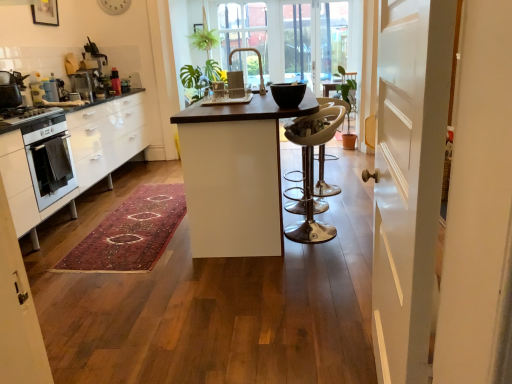
Question: Can you confirm if metallic silver coffee machine at left, the 3th appliance in the bottom-to-top sequence, is bigger than metallic silver coffee machine at left, which ranks as the second appliance in front-to-back order?

Choices:
 (A) yes
 (B) no

Answer: (A)

Question: Does metallic silver coffee machine at left, the second appliance from the right, appear on the right side of metallic silver coffee machine at left, which ranks as the second appliance in bottom-to-top order?

Choices:
 (A) no
 (B) yes

Answer: (B)

Question: From a real-world perspective, is metallic silver coffee machine at left, which is counted as the third appliance, starting from the left, below metallic silver coffee machine at left, the fourth appliance when ordered from right to left?

Choices:
 (A) no
 (B) yes

Answer: (A)

Question: Is the depth of metallic silver coffee machine at left, the 2th appliance positioned from the top, greater than that of metallic silver coffee machine at left, the fourth appliance when ordered from right to left?

Choices:
 (A) no
 (B) yes

Answer: (B)

Question: Can you confirm if metallic silver coffee machine at left, the 3th appliance in the bottom-to-top sequence, is shorter than metallic silver coffee machine at left, which ranks as the second appliance in front-to-back order?

Choices:
 (A) no
 (B) yes

Answer: (A)

Question: Can you confirm if metallic silver coffee machine at left, which is counted as the third appliance, starting from the front, is thinner than metallic silver coffee machine at left, which ranks as the second appliance in bottom-to-top order?

Choices:
 (A) yes
 (B) no

Answer: (B)

Question: Are white matte door at center and metallic silver bar stool at center making contact?

Choices:
 (A) yes
 (B) no

Answer: (B)

Question: Does white matte door at center have a smaller size compared to metallic silver bar stool at center?

Choices:
 (A) yes
 (B) no

Answer: (B)

Question: Is white matte door at center positioned with its back to metallic silver bar stool at center?

Choices:
 (A) yes
 (B) no

Answer: (B)

Question: Does white matte door at center contain metallic silver bar stool at center?

Choices:
 (A) no
 (B) yes

Answer: (A)

Question: Is white matte door at center in front of metallic silver bar stool at center?

Choices:
 (A) no
 (B) yes

Answer: (B)

Question: Does white matte door at center have a lesser width compared to metallic silver bar stool at center?

Choices:
 (A) yes
 (B) no

Answer: (A)

Question: Does metallic silver coffee machine at left, which ranks as the second appliance in front-to-back order, have a lesser width compared to metallic silver coffee machine at upper left, the 3th appliance when ordered from right to left?

Choices:
 (A) yes
 (B) no

Answer: (A)